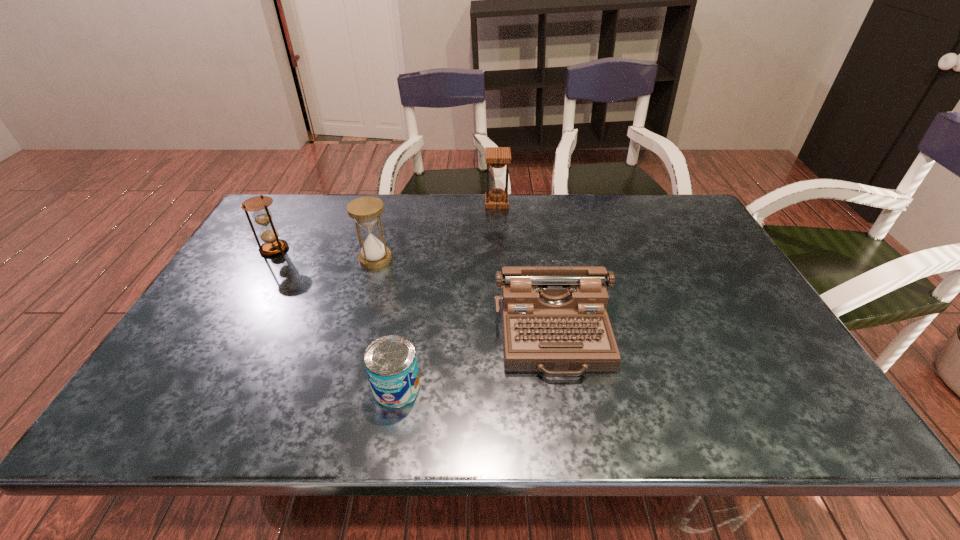
The image size is (960, 540). I want to click on the farthest object, so click(497, 158).

The height and width of the screenshot is (540, 960). Find the location of `the farthest hourglass`. the farthest hourglass is located at coordinates tap(497, 158).

This screenshot has width=960, height=540. In order to click on the second object from left to right in this screenshot , I will do `click(366, 211)`.

The height and width of the screenshot is (540, 960). Identify the location of the leftmost object. (261, 215).

I want to click on typewriter, so click(554, 320).

At what (x,y) coordinates should I click in order to perform the action: click on the third object from left to right. Please return your answer as a coordinate pair (x, y). This screenshot has height=540, width=960. Looking at the image, I should click on (391, 364).

I want to click on can, so click(391, 364).

This screenshot has height=540, width=960. In order to click on free space located on the front of the farthest hourglass in this screenshot , I will do `click(498, 226)`.

Locate an element on the screen. vacant space located on the right of the second hourglass from right to left is located at coordinates (481, 259).

What are the coordinates of `blank area located 0.200m on the back of the leftmost hourglass` in the screenshot? It's located at (299, 206).